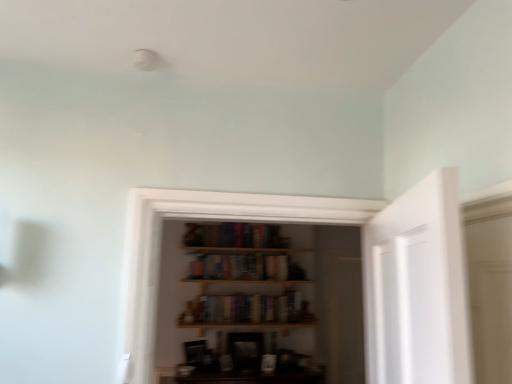
Find the location of a particular element. The image size is (512, 384). hardcover books at center, the first book from the top is located at coordinates (239, 267).

Describe the element at coordinates (239, 267) in the screenshot. The height and width of the screenshot is (384, 512). I see `hardcover books at center, the first book from the top` at that location.

The image size is (512, 384). What do you see at coordinates (245, 309) in the screenshot?
I see `hardcover books at center, the first book from the bottom` at bounding box center [245, 309].

Where is `hardcover books at center, the first book from the bottom`? Image resolution: width=512 pixels, height=384 pixels. hardcover books at center, the first book from the bottom is located at coordinates (245, 309).

Where is `hardcover books at center, which is counted as the 2th book, starting from the bottom`? The height and width of the screenshot is (384, 512). hardcover books at center, which is counted as the 2th book, starting from the bottom is located at coordinates (239, 267).

Between hardcover books at center, the 2th book when ordered from top to bottom, and hardcover books at center, the first book from the top, which one appears on the left side from the viewer's perspective?

Positioned to the left is hardcover books at center, the first book from the top.

In the image, is hardcover books at center, the first book from the bottom, positioned in front of or behind hardcover books at center, which is counted as the 2th book, starting from the bottom?

In the image, hardcover books at center, the first book from the bottom, appears in front of hardcover books at center, which is counted as the 2th book, starting from the bottom.

Is point (214, 320) behind point (281, 264)?

That is False.

From the image's perspective, between hardcover books at center, the 2th book when ordered from top to bottom, and hardcover books at center, the first book from the top, which one is located above?

hardcover books at center, the first book from the top, appears higher in the image.

From a real-world perspective, who is located higher, hardcover books at center, the 2th book when ordered from top to bottom, or hardcover books at center, the first book from the top?

hardcover books at center, the first book from the top, from a real-world perspective.

Can you confirm if hardcover books at center, the 2th book when ordered from top to bottom, is thinner than hardcover books at center, which is counted as the 2th book, starting from the bottom?

Yes.

From their relative heights in the image, would you say hardcover books at center, the first book from the bottom, is taller or shorter than hardcover books at center, the first book from the top?

In the image, hardcover books at center, the first book from the bottom, appears to be taller than hardcover books at center, the first book from the top.

Is hardcover books at center, the first book from the bottom, bigger than hardcover books at center, which is counted as the 2th book, starting from the bottom?

No.

Choose the correct answer: Is hardcover books at center, the 2th book when ordered from top to bottom, inside hardcover books at center, which is counted as the 2th book, starting from the bottom, or outside it?

hardcover books at center, the 2th book when ordered from top to bottom, is not enclosed by hardcover books at center, which is counted as the 2th book, starting from the bottom.

Are hardcover books at center, the first book from the bottom, and hardcover books at center, the first book from the top, far apart?

No.

Consider the image. Is hardcover books at center, the first book from the bottom, oriented away from hardcover books at center, the first book from the top?

That's not correct — hardcover books at center, the first book from the bottom, is not looking away from hardcover books at center, the first book from the top.

Where is `book below the hardcover books at center, the first book from the top (from the image's perspective)`? Image resolution: width=512 pixels, height=384 pixels. book below the hardcover books at center, the first book from the top (from the image's perspective) is located at coordinates (245, 309).

Considering the relative positions of hardcover books at center, which is counted as the 2th book, starting from the bottom, and hardcover books at center, the first book from the bottom, in the image provided, is hardcover books at center, which is counted as the 2th book, starting from the bottom, to the right of hardcover books at center, the first book from the bottom, from the viewer's perspective?

Incorrect, hardcover books at center, which is counted as the 2th book, starting from the bottom, is not on the right side of hardcover books at center, the first book from the bottom.

Based on the photo, in the image, is hardcover books at center, which is counted as the 2th book, starting from the bottom, positioned in front of or behind hardcover books at center, the first book from the bottom?

Visually, hardcover books at center, which is counted as the 2th book, starting from the bottom, is located behind hardcover books at center, the first book from the bottom.

Which is in front, point (207, 265) or point (285, 318)?

The point (207, 265) is in front.

From the image's perspective, who appears lower, hardcover books at center, which is counted as the 2th book, starting from the bottom, or hardcover books at center, the 2th book when ordered from top to bottom?

hardcover books at center, the 2th book when ordered from top to bottom, appears lower in the image.

From a real-world perspective, is hardcover books at center, which is counted as the 2th book, starting from the bottom, located higher than hardcover books at center, the first book from the bottom?

Yes, from a real-world perspective, hardcover books at center, which is counted as the 2th book, starting from the bottom, is over hardcover books at center, the first book from the bottom

Which object is wider, hardcover books at center, which is counted as the 2th book, starting from the bottom, or hardcover books at center, the first book from the bottom?

With larger width is hardcover books at center, which is counted as the 2th book, starting from the bottom.

Does hardcover books at center, which is counted as the 2th book, starting from the bottom, have a greater height compared to hardcover books at center, the 2th book when ordered from top to bottom?

Incorrect, the height of hardcover books at center, which is counted as the 2th book, starting from the bottom, is not larger of that of hardcover books at center, the 2th book when ordered from top to bottom.

Who is bigger, hardcover books at center, the first book from the top, or hardcover books at center, the first book from the bottom?

Bigger between the two is hardcover books at center, the first book from the top.

Can we say hardcover books at center, the first book from the top, lies outside hardcover books at center, the first book from the bottom?

Yes, hardcover books at center, the first book from the top, is located beyond the bounds of hardcover books at center, the first book from the bottom.

Is hardcover books at center, which is counted as the 2th book, starting from the bottom, not close to hardcover books at center, the first book from the bottom?

No, hardcover books at center, which is counted as the 2th book, starting from the bottom, is in close proximity to hardcover books at center, the first book from the bottom.

Is hardcover books at center, the first book from the top, facing towards hardcover books at center, the first book from the bottom?

No.

Image resolution: width=512 pixels, height=384 pixels. I want to click on book that is behind the hardcover books at center, the first book from the bottom, so click(x=239, y=267).

The width and height of the screenshot is (512, 384). In order to click on book located on the right of hardcover books at center, which is counted as the 2th book, starting from the bottom in this screenshot , I will do `click(245, 309)`.

Identify the location of book above the hardcover books at center, the first book from the bottom (from the image's perspective). Image resolution: width=512 pixels, height=384 pixels. pos(239,267).